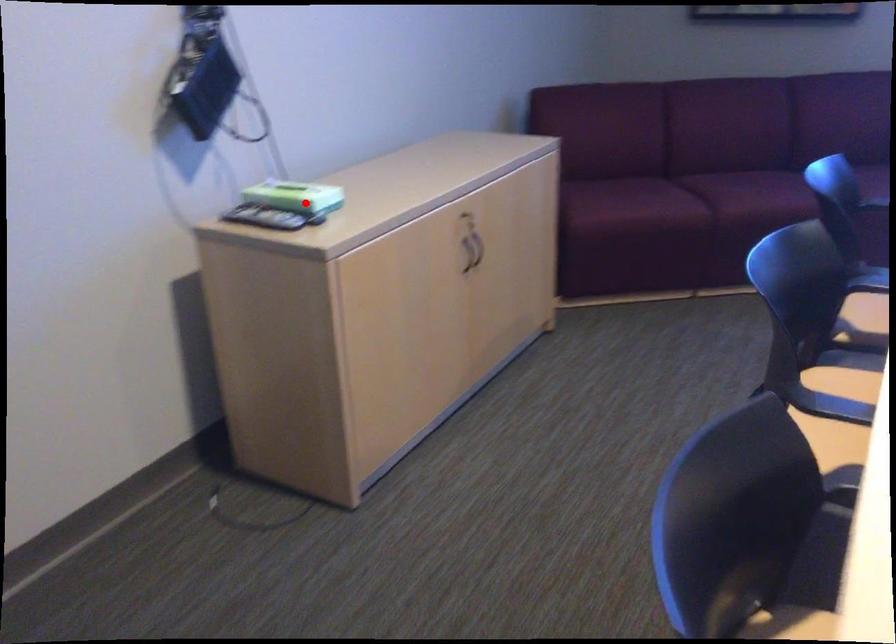
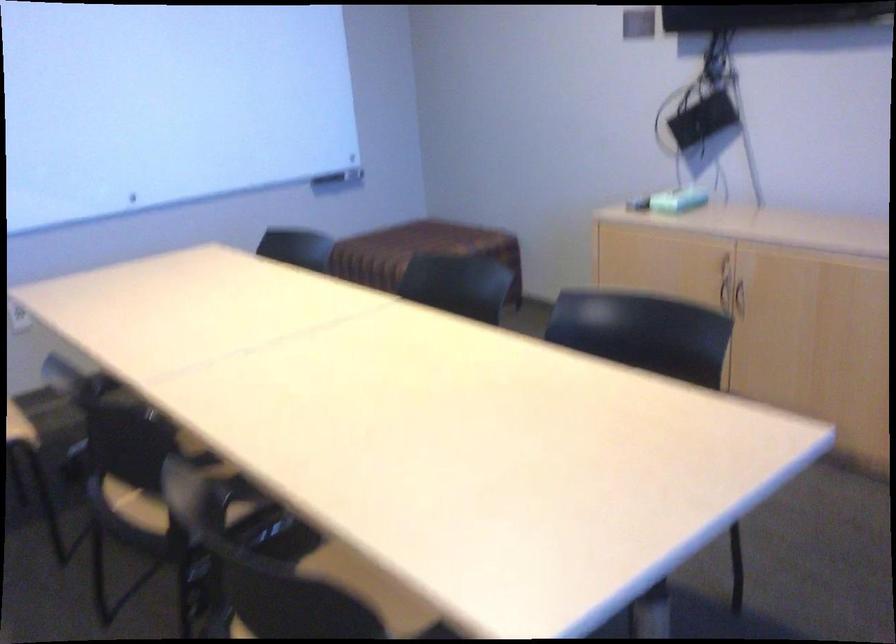
Find the pixel in the second image that matches the highlighted location in the first image.

(677, 200)